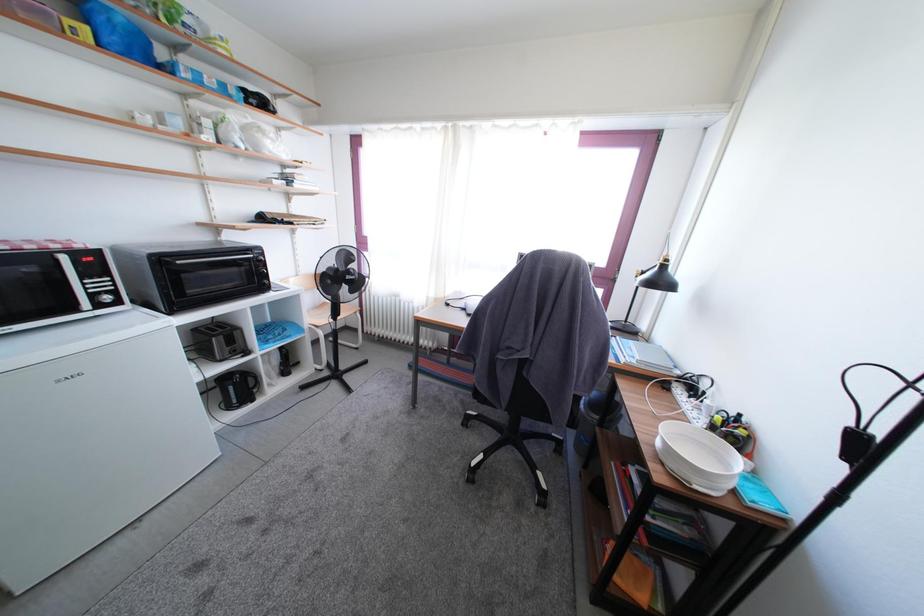
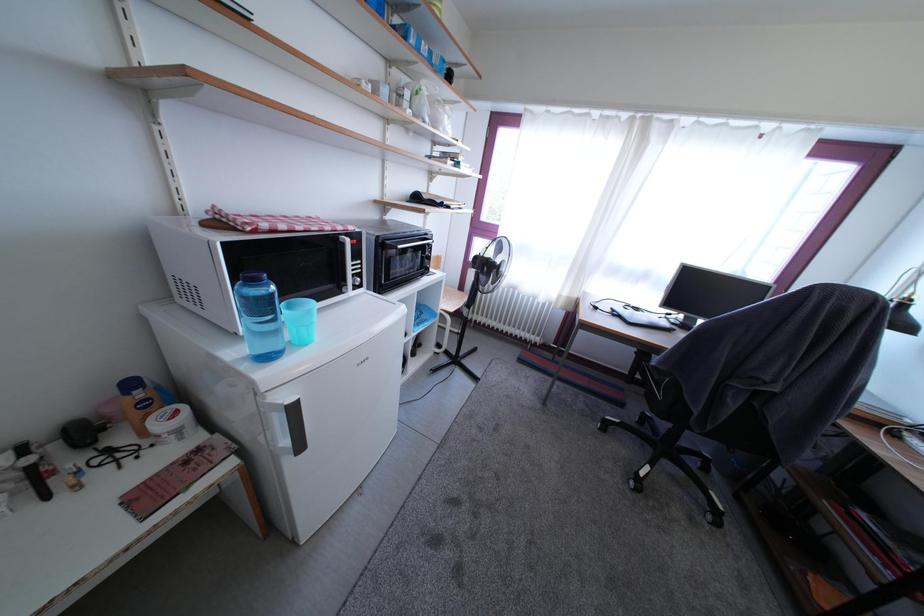
Question: In a continuous first-person perspective shot, in which direction is the camera moving?

Choices:
 (A) Left
 (B) Right
 (C) Forward
 (D) Backward

Answer: (A)